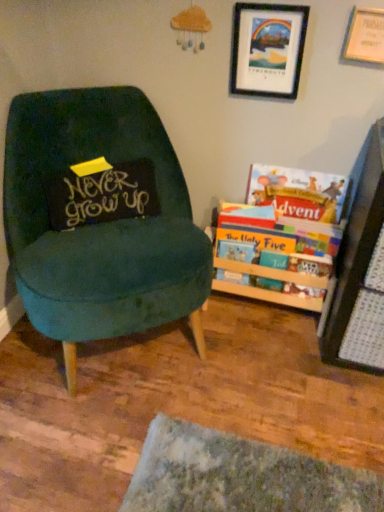
Locate an element on the screen. The width and height of the screenshot is (384, 512). vacant space that's between teal velvet chair at left and hardcover book at right, placed as the 2th book when sorted from top to bottom is located at coordinates (242, 349).